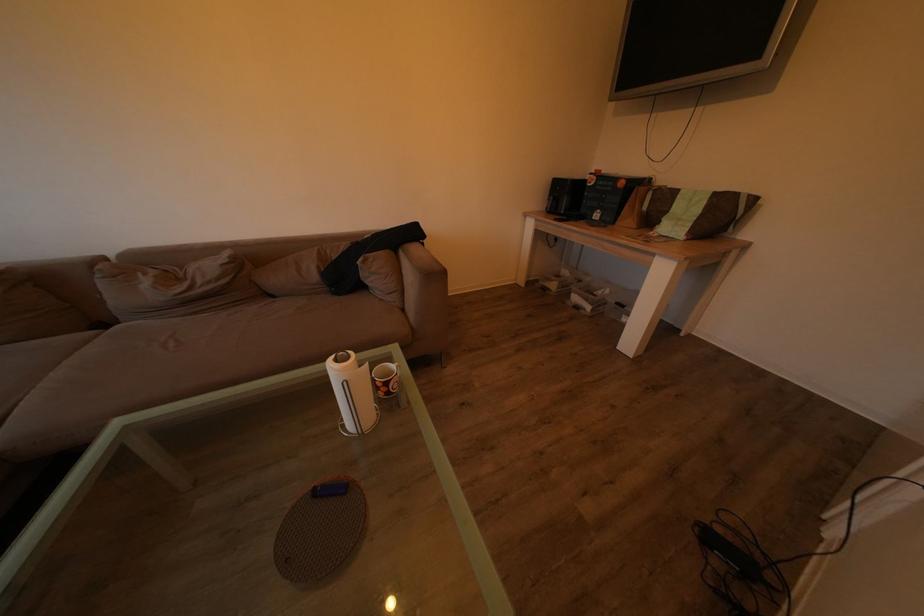
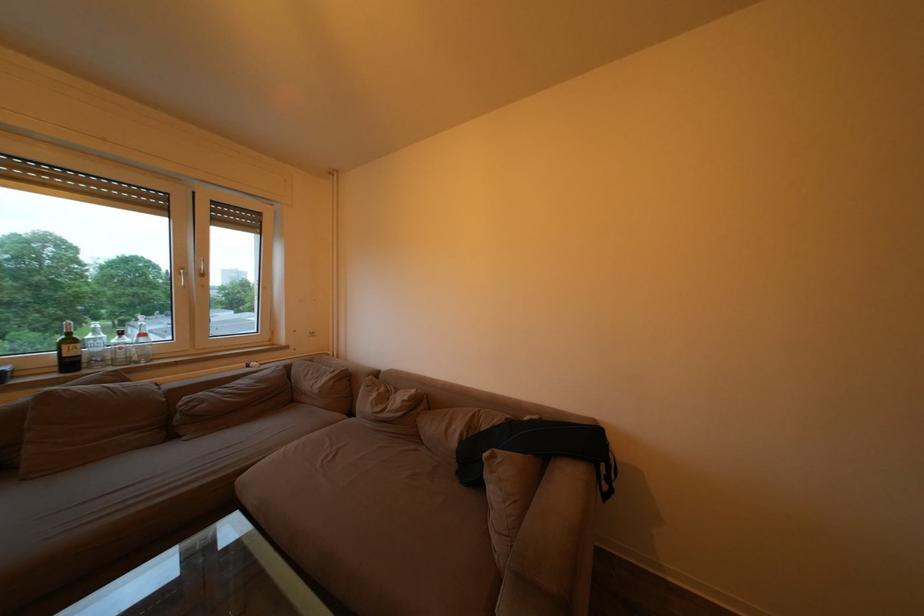
Question: The first image is from the beginning of the video and the second image is from the end. How did the camera likely rotate when shooting the video?

Choices:
 (A) Left
 (B) Right
 (C) Up
 (D) Down

Answer: (A)